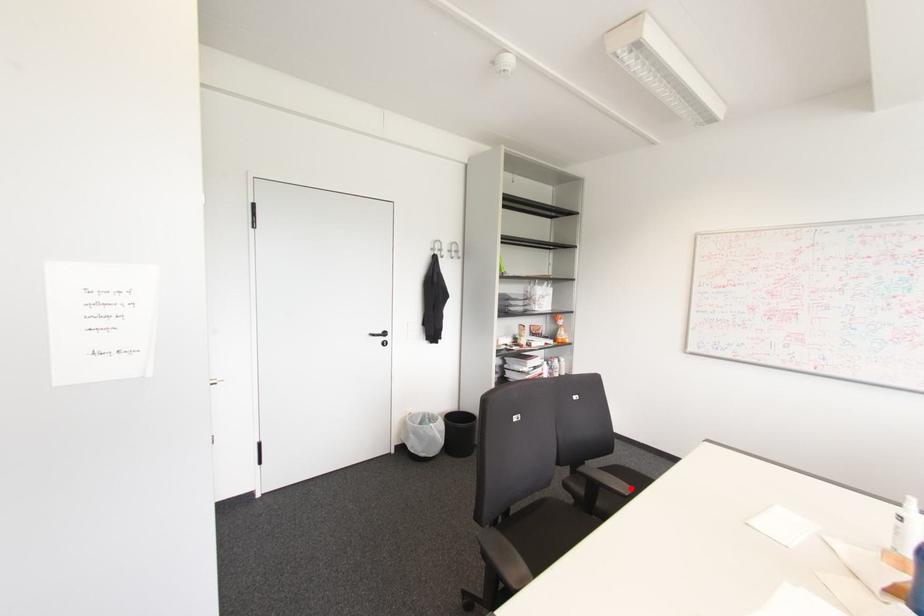
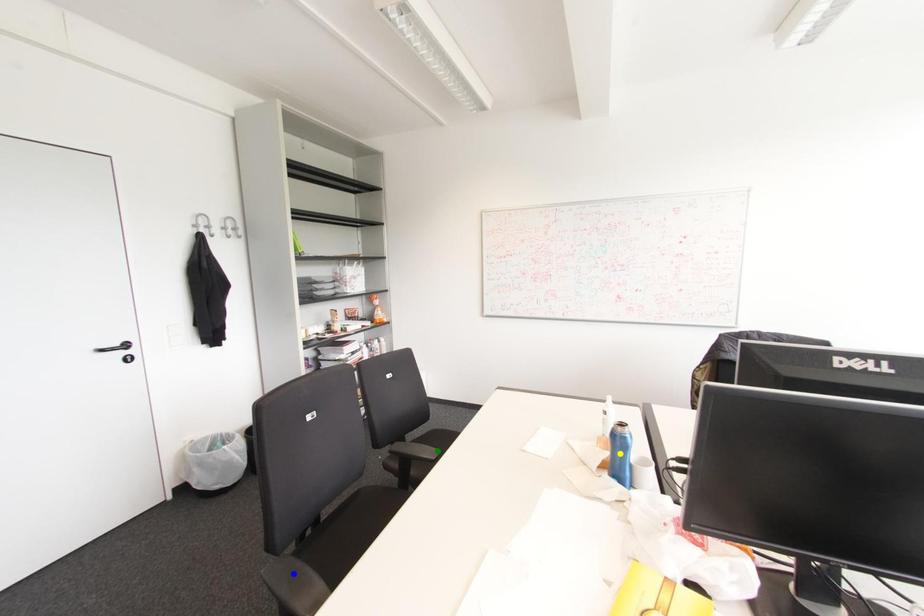
Question: I am providing you with two images of the same scene from different viewpoints. A red point is marked on the first image. You are given multiple points on the second image. Which spot in image 2 lines up with the point in image 1?

Choices:
 (A) green point
 (B) yellow point
 (C) blue point

Answer: (A)